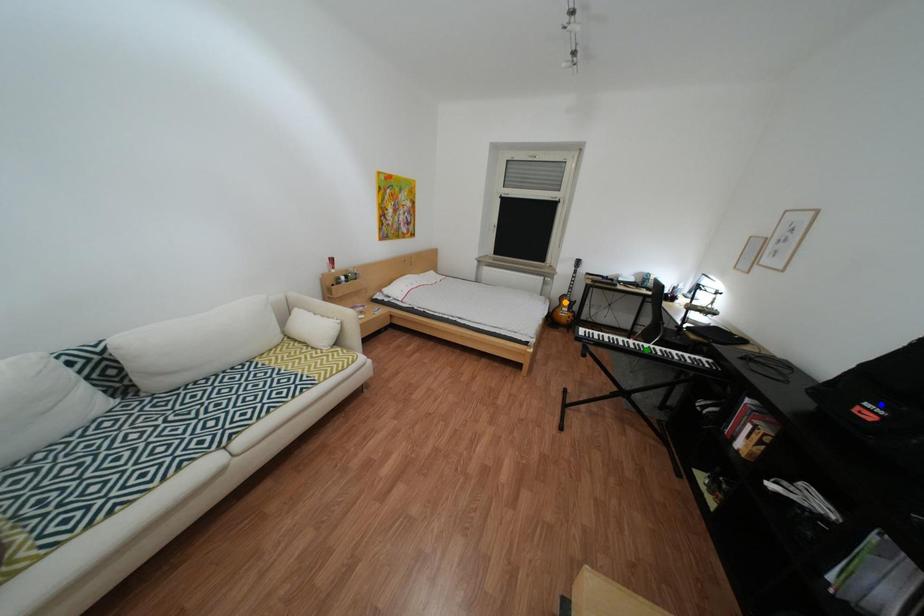
Order these from nearest to farthest:
blue point | orange point | green point

blue point, green point, orange point